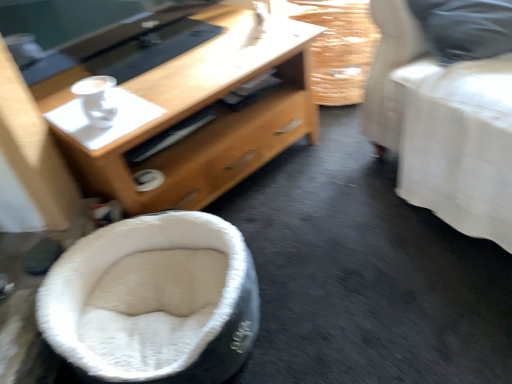
Question: In terms of height, does white glossy cup at upper left look taller or shorter compared to wooden desk at center?

Choices:
 (A) short
 (B) tall

Answer: (A)

Question: Based on their sizes in the image, would you say white glossy cup at upper left is bigger or smaller than wooden desk at center?

Choices:
 (A) small
 (B) big

Answer: (A)

Question: Which is farther from the burlap-like fabric basket at upper right?

Choices:
 (A) white glossy cup at upper left
 (B) white fuzzy bean bag at lower left
 (C) wooden desk at center
 (D) white fabric bed at right

Answer: (B)

Question: Which object is positioned closest to the wooden desk at center?

Choices:
 (A) white fabric bed at right
 (B) white glossy cup at upper left
 (C) burlap-like fabric basket at upper right
 (D) white fuzzy bean bag at lower left

Answer: (B)